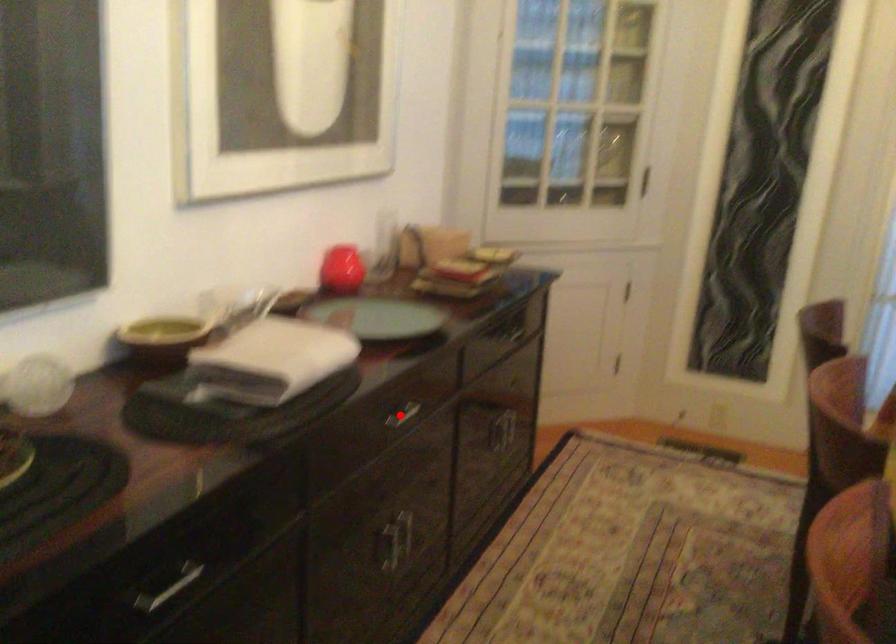
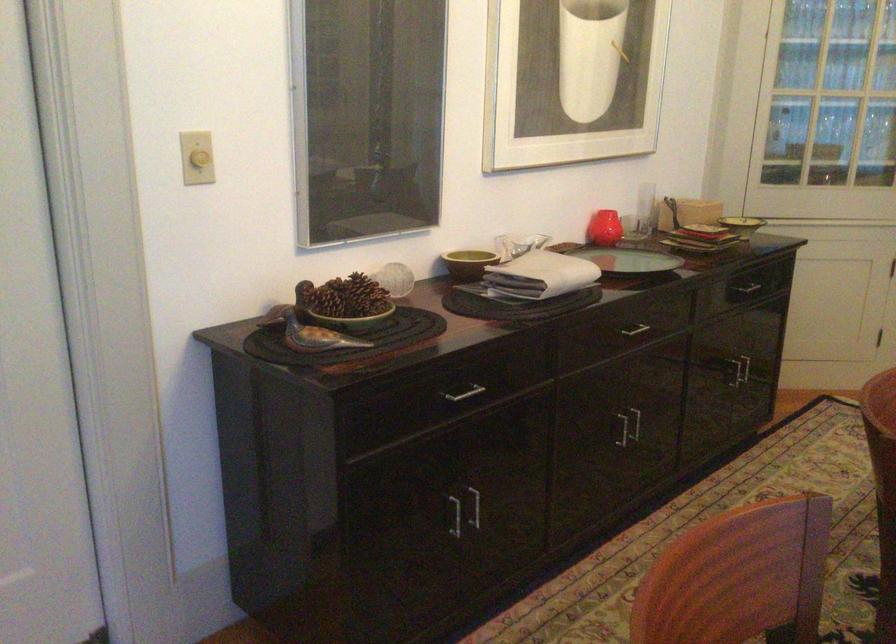
The point at the highlighted location is marked in the first image. Where is the corresponding point in the second image?

(634, 328)